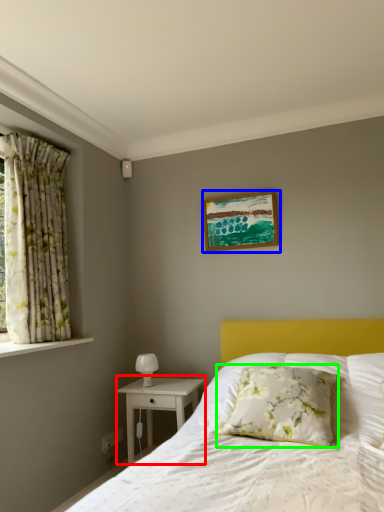
Question: Estimate the real-world distances between objects in this image. Which object is farther from nightstand (highlighted by a red box), picture frame (highlighted by a blue box) or pillow (highlighted by a green box)?

Choices:
 (A) picture frame
 (B) pillow

Answer: (A)